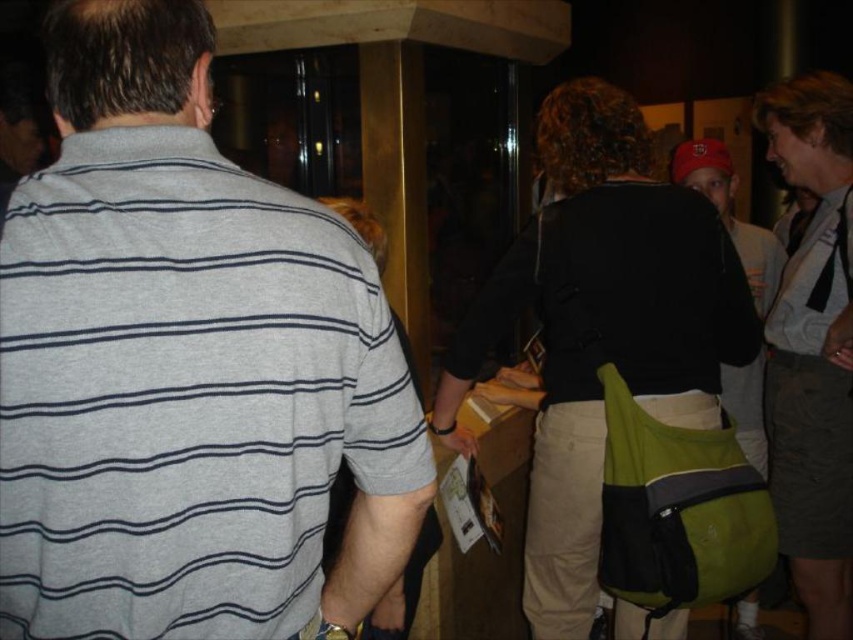
Question: Which point is closer to the camera?

Choices:
 (A) (747, 312)
 (B) (33, 305)

Answer: (B)

Question: Is gray striped shirt at left below green fabric backpack at center?

Choices:
 (A) no
 (B) yes

Answer: (A)

Question: Is gray striped shirt at left below green fabric backpack at center?

Choices:
 (A) no
 (B) yes

Answer: (A)

Question: Does gray striped shirt at left have a smaller size compared to green fabric backpack at center?

Choices:
 (A) yes
 (B) no

Answer: (A)

Question: Which object appears farthest from the camera in this image?

Choices:
 (A) green fabric backpack at center
 (B) gray striped shirt at left

Answer: (A)

Question: Which point is closer to the camera?

Choices:
 (A) gray striped shirt at left
 (B) green fabric backpack at center

Answer: (A)